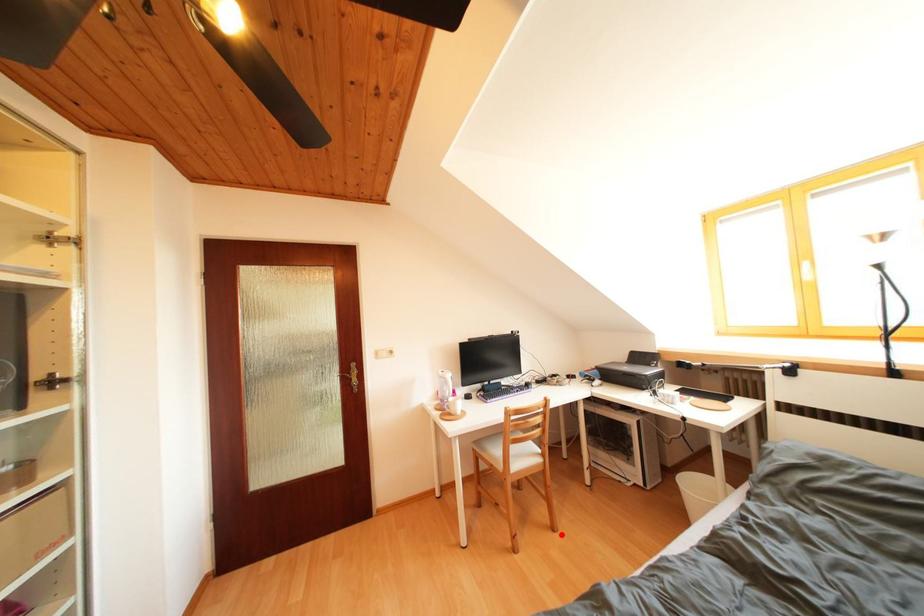
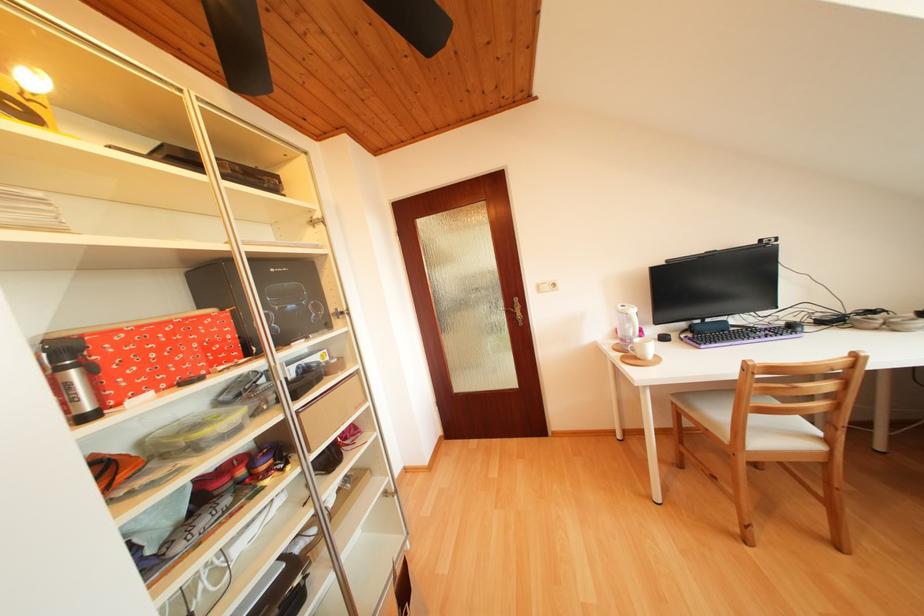
Question: I am providing you with two images of the same scene from different viewpoints. Image1 has a red point marked. In image2, the corresponding 3D location appears at what relative position? Reply with the corresponding letter.

Choices:
 (A) Closer
 (B) Farther

Answer: (B)